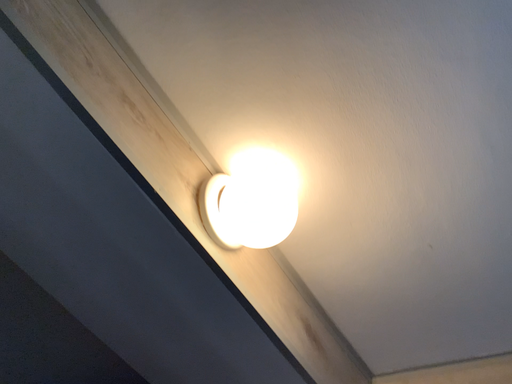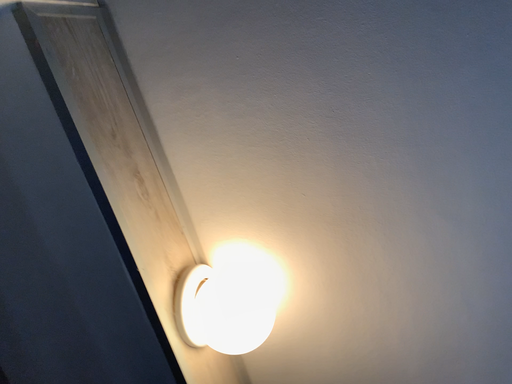
Question: Which way did the camera rotate in the video?

Choices:
 (A) rotated downward
 (B) rotated upward

Answer: (B)